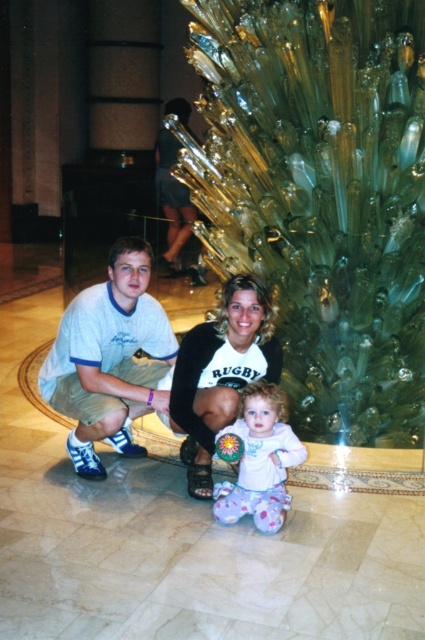
You are a photographer setting up for a family photo in a luxurious indoor setting. You need to position two subjects wearing a white cotton shirt at center and a fluffy white onesie at center so that there is exactly 3 feet between them. Can you achieve this spacing with their current positions?

The white cotton shirt at center and fluffy white onesie at center are currently 3.39 feet apart, which is slightly more than the required 3 feet. To achieve exactly 3 feet, the subjects should move closer by approximately 0.39 feet.

You are a photographer setting up a tripod in the center of the room. The white matte sweater at center is located at coordinates 0.583, 0.518. Will the sweater be in the center of your photo if you aim the camera directly at the room center?

The white matte sweater at center is positioned at point (220,372), which is slightly offset from the exact center of the room. Therefore, if you aim the camera directly at the room center, the sweater will not be perfectly centered in the photo.